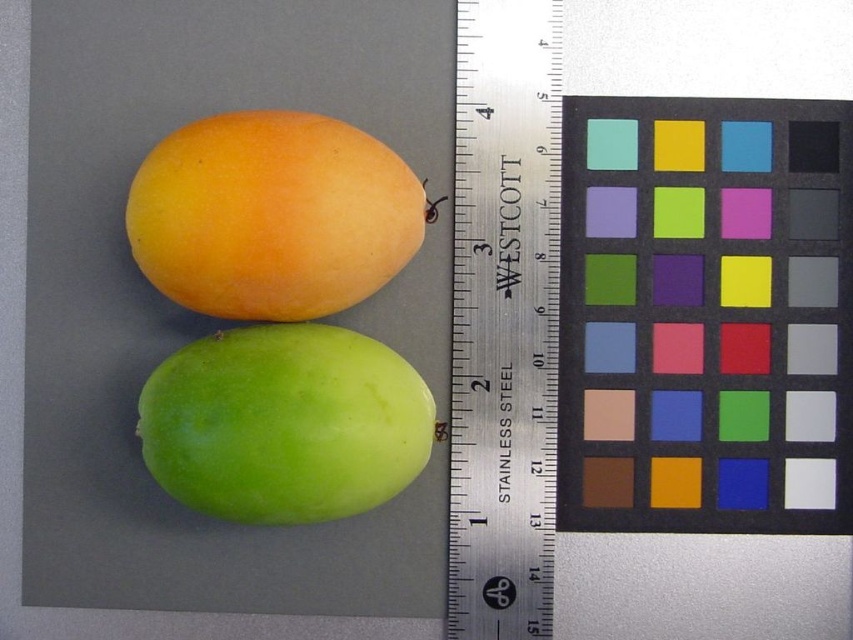
From the picture: You are a quality inspector checking the placement of items on a packaging tray. The tray has a designated area for the stainless steel ruler at center and the matte orange mango at upper left. According to the provided image, is the ruler placed correctly relative to the mango?

The stainless steel ruler at center is located below the matte orange mango at upper left, so it is placed correctly as per the designated area.

You are an inspector checking the arrangement of fruits on a table. You notice two points marked on the table. The first point is at coordinate point (485, 120) and the second point is at coordinate point (373, 433). From your viewpoint, which point is closer to you?

Point (373, 433) is closer to you because the description states that point (485, 120) is behind point (373, 433).